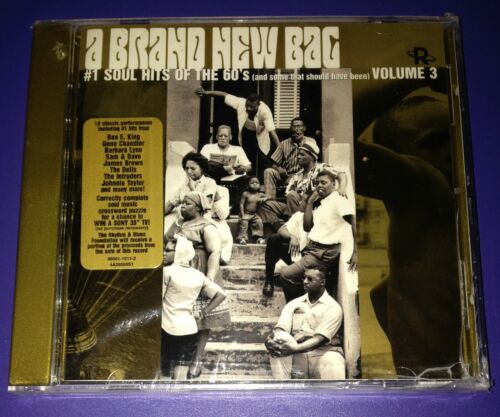
Locate an element on the screen. door is located at coordinates (245, 88).